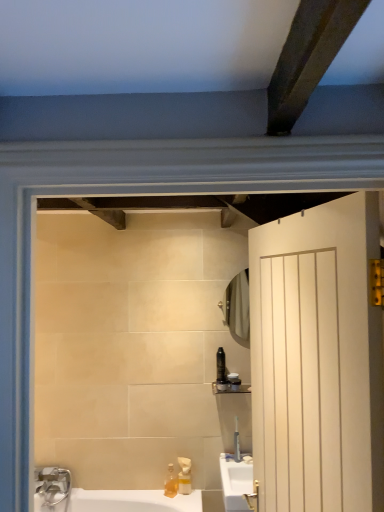
Question: From the image's perspective, is matte black shelf at upper center above or below matte glass mirror at upper center?

Choices:
 (A) below
 (B) above

Answer: (A)

Question: Does point tap(230, 392) appear closer or farther from the camera than point tap(244, 314)?

Choices:
 (A) farther
 (B) closer

Answer: (A)

Question: Estimate the real-world distances between objects in this image. Which object is farther from the translucent plastic soap dispenser at lower center, placed as the first soap dispenser when sorted from left to right?

Choices:
 (A) white wood door at right
 (B) black plastic toothbrush at upper center, the first toiletry from the top
 (C) translucent plastic soap dispenser at lower center, the 1th soap dispenser positioned from the right
 (D) matte black shelf at upper center
 (E) matte black container at upper right, which is the 3th toiletry from bottom to top

Answer: (A)

Question: Estimate the real-world distances between objects in this image. Which object is farther from the translucent plastic soap dispenser at lower center, placed as the second soap dispenser when sorted from left to right?

Choices:
 (A) matte glass mirror at upper center
 (B) matte black container at upper right, which is the 3th toiletry from bottom to top
 (C) white wood door at right
 (D) black plastic toothbrush at upper center, the first toiletry from the top
 (E) clear plastic tube at upper center, which ranks as the first toiletry in bottom-to-top order

Answer: (C)